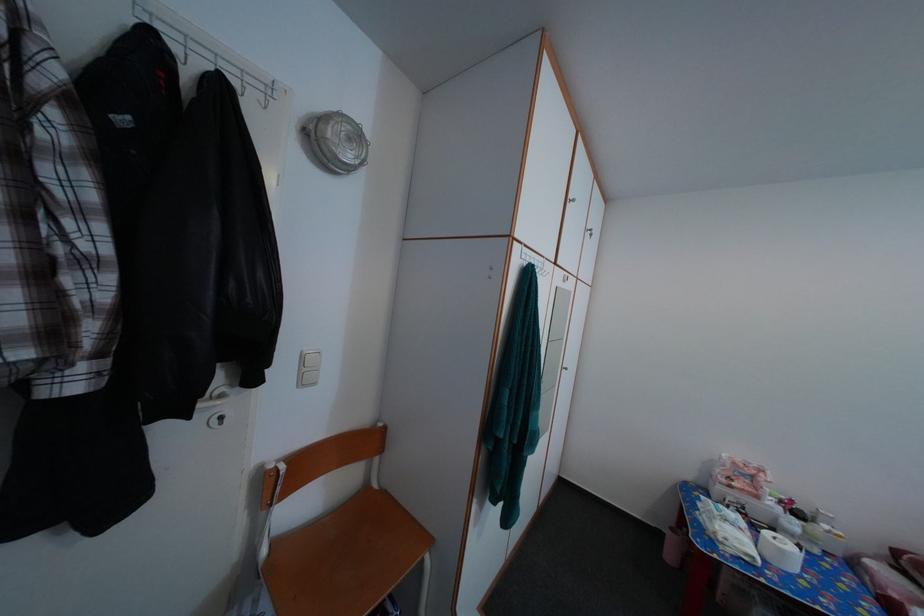
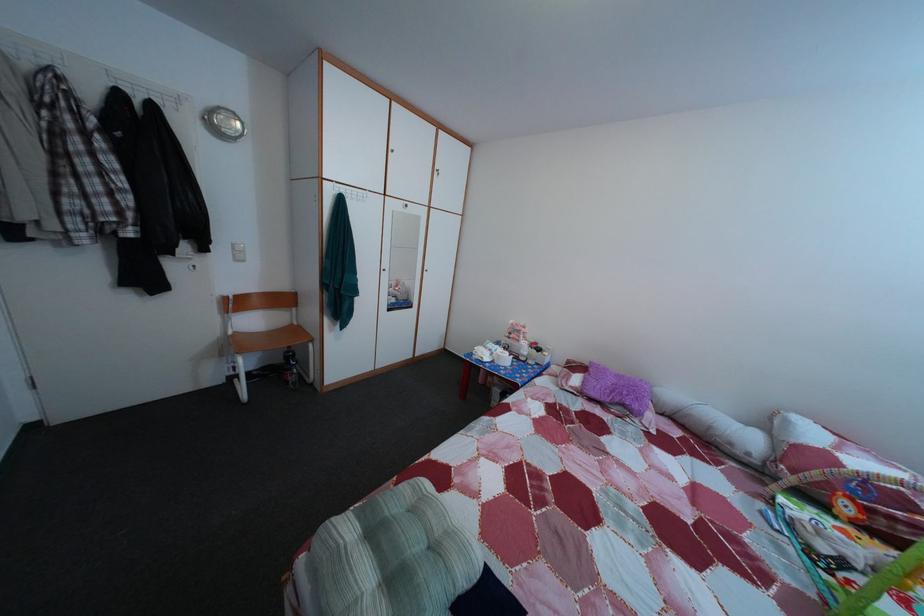
In a continuous first-person perspective shot, in which direction is the camera moving?

The movement direction of the cameraman is right, backward.